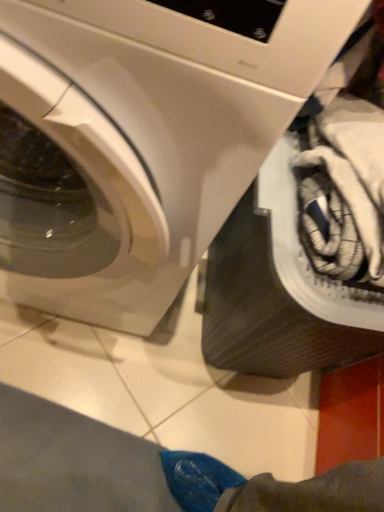
Question: Would you say black rubber tire at lower right is to the left or to the right of white glossy washing machine at upper left in the picture?

Choices:
 (A) right
 (B) left

Answer: (A)

Question: Is black rubber tire at lower right taller or shorter than white glossy washing machine at upper left?

Choices:
 (A) short
 (B) tall

Answer: (A)

Question: Is point (266, 279) closer or farther from the camera than point (301, 91)?

Choices:
 (A) closer
 (B) farther

Answer: (B)

Question: In the image, is white glossy washing machine at upper left positioned in front of or behind black rubber tire at lower right?

Choices:
 (A) front
 (B) behind

Answer: (A)

Question: Looking at the image, does white glossy washing machine at upper left seem bigger or smaller compared to black rubber tire at lower right?

Choices:
 (A) big
 (B) small

Answer: (A)

Question: In terms of width, does white glossy washing machine at upper left look wider or thinner when compared to black rubber tire at lower right?

Choices:
 (A) thin
 (B) wide

Answer: (B)

Question: From a real-world perspective, is white glossy washing machine at upper left physically located above or below black rubber tire at lower right?

Choices:
 (A) above
 (B) below

Answer: (A)